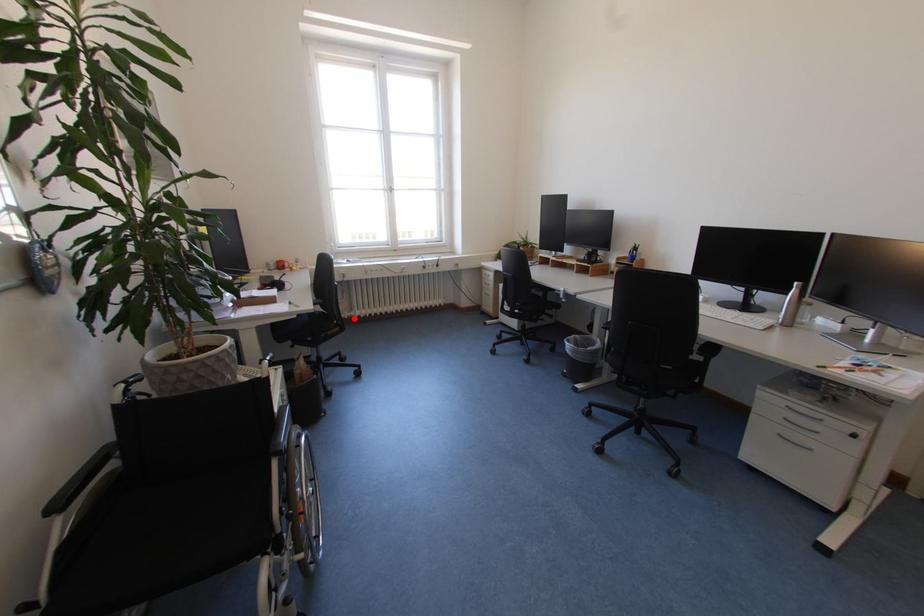
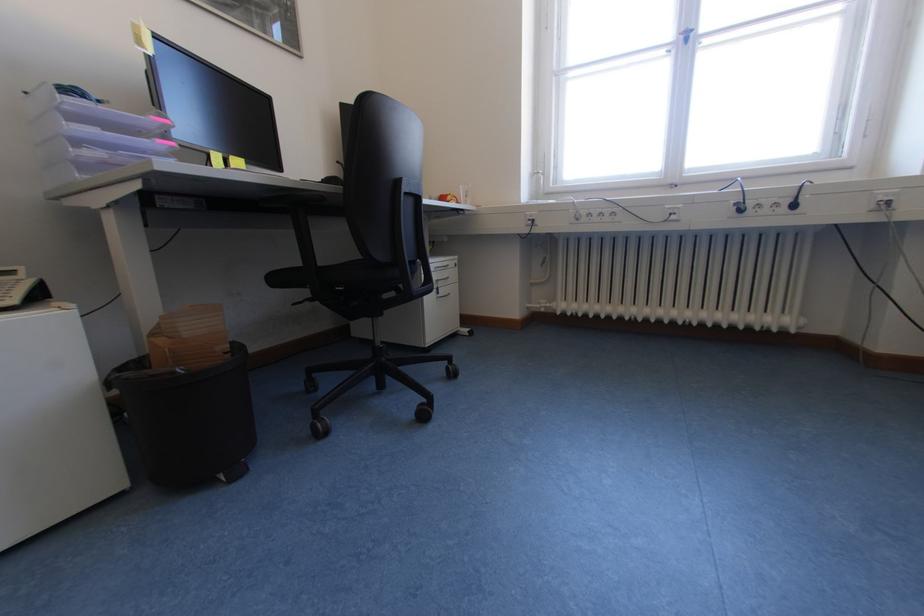
The point at the highlighted location is marked in the first image. Where is the corresponding point in the second image?

(551, 310)